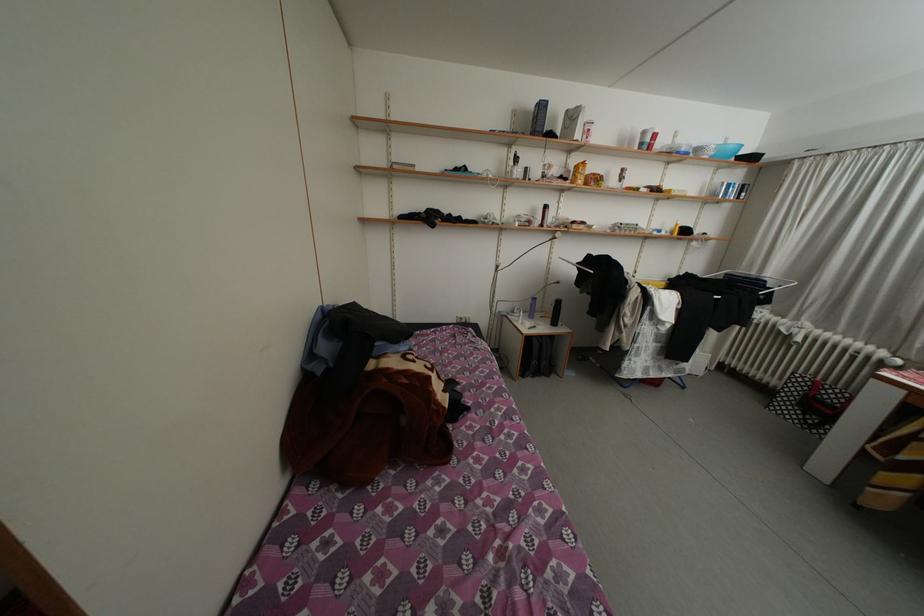
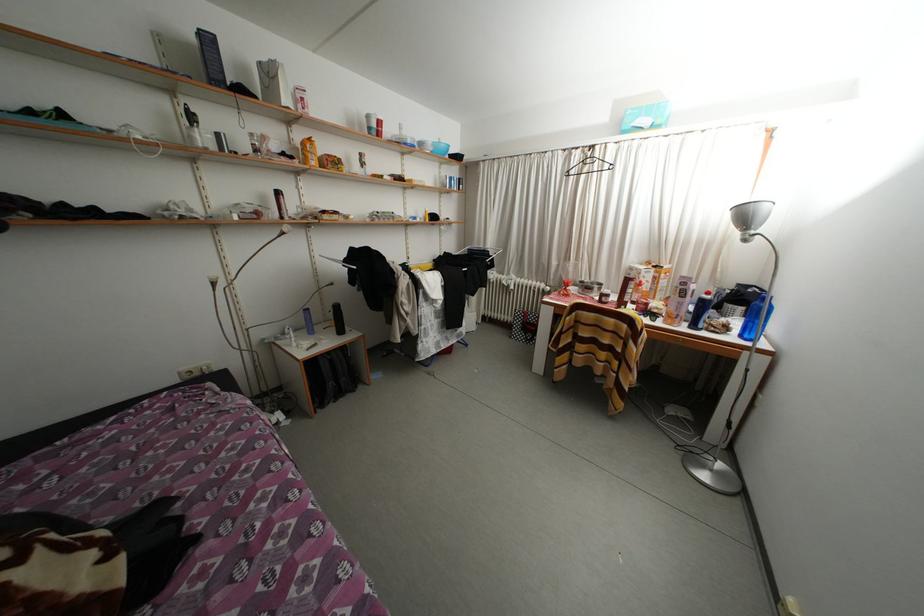
Question: The camera is either moving clockwise (left) or counter-clockwise (right) around the object. The first image is from the beginning of the video and the second image is from the end. Is the camera moving left or right when shooting the video?

Choices:
 (A) Left
 (B) Right

Answer: (A)